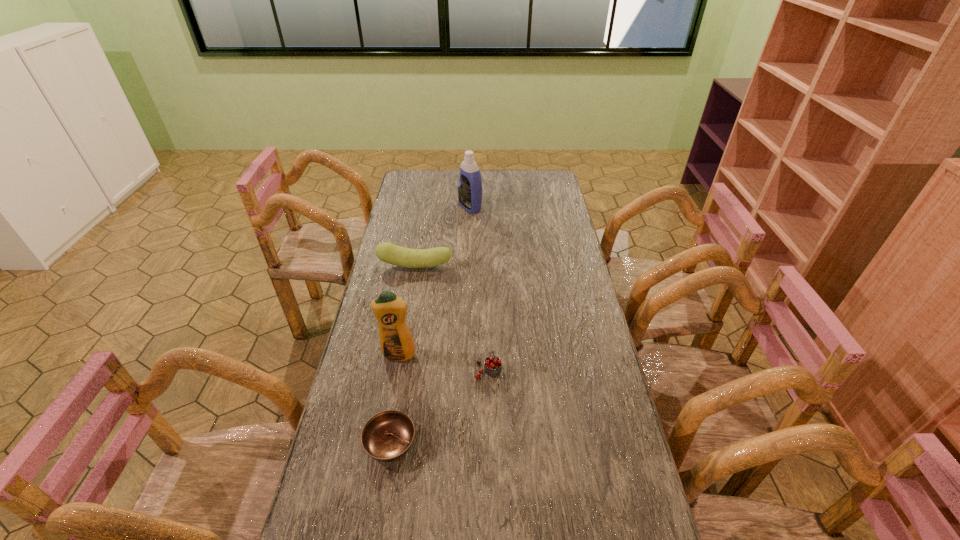
What are the coordinates of `the farthest object` in the screenshot? It's located at (470, 185).

I want to click on the farther detergent, so click(470, 185).

Identify the location of the left detergent. The image size is (960, 540). (396, 342).

This screenshot has height=540, width=960. What are the coordinates of `the third tallest object` in the screenshot? It's located at (387, 252).

Image resolution: width=960 pixels, height=540 pixels. In order to click on the second farthest object in this screenshot , I will do `click(387, 252)`.

Where is `the fourth tallest object`? the fourth tallest object is located at coordinates (492, 365).

Find the location of a particular element. the nearest object is located at coordinates (387, 436).

Identify the location of soup bowl. (387, 436).

Locate an element on the screen. Image resolution: width=960 pixels, height=540 pixels. free space located on the back of the right detergent is located at coordinates (471, 180).

Image resolution: width=960 pixels, height=540 pixels. Find the location of `vacant space located on the label of the left detergent`. vacant space located on the label of the left detergent is located at coordinates (389, 409).